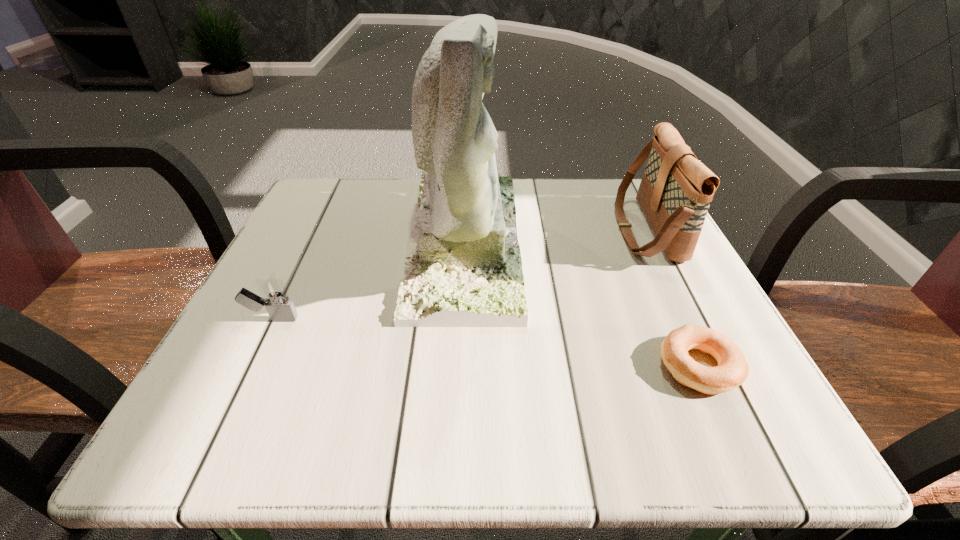
In order to click on vacant space located 0.150m on the front-facing side of the second tallest object in this screenshot , I will do point(546,230).

Image resolution: width=960 pixels, height=540 pixels. In order to click on vacant space located 0.150m on the front of the igniter in this screenshot , I will do `click(227, 411)`.

You are a GUI agent. You are given a task and a screenshot of the screen. Output one action in this format:
    pyautogui.click(x=<x>, y=<y>)
    Task: Click on the free region located 0.400m on the left of the nearest object
    Image resolution: width=960 pixels, height=540 pixels.
    Given the screenshot: What is the action you would take?
    (389, 366)

Identify the location of sculpture located in the far edge section of the desktop. The width and height of the screenshot is (960, 540). (463, 269).

Identify the location of shoulder bag situated at the far edge. (676, 189).

I want to click on object located in the near edge section of the desktop, so click(x=732, y=370).

Where is `object that is at the left edge`? This screenshot has height=540, width=960. object that is at the left edge is located at coordinates (275, 298).

Locate an element on the screen. shoulder bag positioned at the right edge is located at coordinates (676, 189).

Locate an element on the screen. This screenshot has height=540, width=960. bagel positioned at the right edge is located at coordinates (732, 370).

Image resolution: width=960 pixels, height=540 pixels. Find the location of `object at the far right corner`. object at the far right corner is located at coordinates (676, 189).